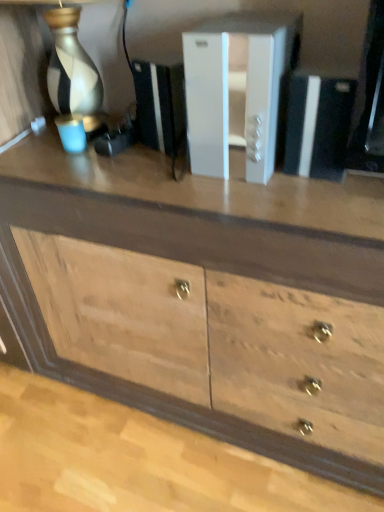
Question: Considering the relative sizes of wooden chest of drawers at center and white plastic file cabinet at center in the image provided, is wooden chest of drawers at center taller than white plastic file cabinet at center?

Choices:
 (A) no
 (B) yes

Answer: (B)

Question: Does wooden chest of drawers at center have a larger size compared to white plastic file cabinet at center?

Choices:
 (A) yes
 (B) no

Answer: (A)

Question: Does wooden chest of drawers at center turn towards white plastic file cabinet at center?

Choices:
 (A) yes
 (B) no

Answer: (B)

Question: Is wooden chest of drawers at center to the right of white plastic file cabinet at center from the viewer's perspective?

Choices:
 (A) yes
 (B) no

Answer: (B)

Question: Would you say wooden chest of drawers at center is a long distance from white plastic file cabinet at center?

Choices:
 (A) no
 (B) yes

Answer: (A)

Question: Considering the relative sizes of wooden chest of drawers at center and white plastic file cabinet at center in the image provided, is wooden chest of drawers at center smaller than white plastic file cabinet at center?

Choices:
 (A) no
 (B) yes

Answer: (A)

Question: Are white plastic file cabinet at center and wooden chest of drawers at center far apart?

Choices:
 (A) no
 (B) yes

Answer: (A)

Question: Is white plastic file cabinet at center facing towards wooden chest of drawers at center?

Choices:
 (A) yes
 (B) no

Answer: (B)

Question: Considering the relative sizes of white plastic file cabinet at center and wooden chest of drawers at center in the image provided, is white plastic file cabinet at center bigger than wooden chest of drawers at center?

Choices:
 (A) no
 (B) yes

Answer: (A)

Question: Can you confirm if white plastic file cabinet at center is positioned to the left of wooden chest of drawers at center?

Choices:
 (A) yes
 (B) no

Answer: (B)

Question: From the image's perspective, is white plastic file cabinet at center located beneath wooden chest of drawers at center?

Choices:
 (A) no
 (B) yes

Answer: (A)

Question: From a real-world perspective, is white plastic file cabinet at center over wooden chest of drawers at center?

Choices:
 (A) no
 (B) yes

Answer: (B)

Question: Is point (278, 370) closer or farther from the camera than point (269, 73)?

Choices:
 (A) closer
 (B) farther

Answer: (B)